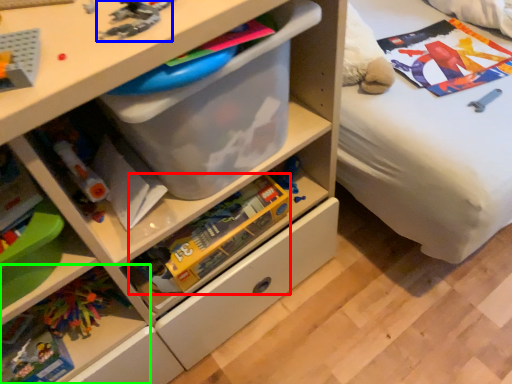
Question: Estimate the real-world distances between objects in this image. Which object is closer to toy (highlighted by a red box), toy (highlighted by a blue box) or shelf (highlighted by a green box)?

Choices:
 (A) toy
 (B) shelf

Answer: (B)